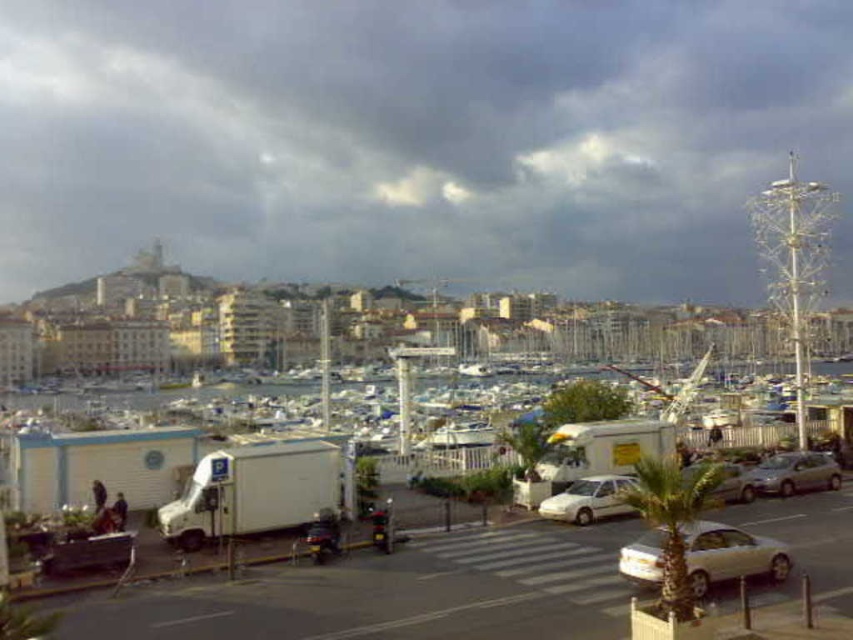
Can you confirm if white matte car at center is positioned below silver metallic hatchback at lower right?

Yes, white matte car at center is below silver metallic hatchback at lower right.

Who is positioned more to the left, white matte car at center or silver metallic hatchback at lower right?

From the viewer's perspective, white matte car at center appears more on the left side.

Locate an element on the screen. The height and width of the screenshot is (640, 853). white matte car at center is located at coordinates (589, 499).

You are a GUI agent. You are given a task and a screenshot of the screen. Output one action in this format:
    pyautogui.click(x=<x>, y=<y>)
    Task: Click on the white matte car at center
    The image size is (853, 640).
    Given the screenshot: What is the action you would take?
    pyautogui.click(x=589, y=499)

Looking at this image, which of these two, white matte trailer truck at lower left or white glossy car at lower right, stands taller?

white matte trailer truck at lower left

Does white matte trailer truck at lower left have a lesser height compared to white glossy car at lower right?

No.

Who is more forward, [286,525] or [711,525]?

Point [711,525] is more forward.

You are a GUI agent. You are given a task and a screenshot of the screen. Output one action in this format:
    pyautogui.click(x=<x>, y=<y>)
    Task: Click on the white matte trailer truck at lower left
    This screenshot has height=640, width=853.
    Given the screenshot: What is the action you would take?
    [x=254, y=490]

How far apart are white glossy car at lower right and silver metallic hatchback at lower right?

11.36 meters

Is point (701, 529) positioned after point (770, 477)?

That is False.

Describe the element at coordinates (729, 554) in the screenshot. I see `white glossy car at lower right` at that location.

Find the location of a particular element. white glossy car at lower right is located at coordinates (729, 554).